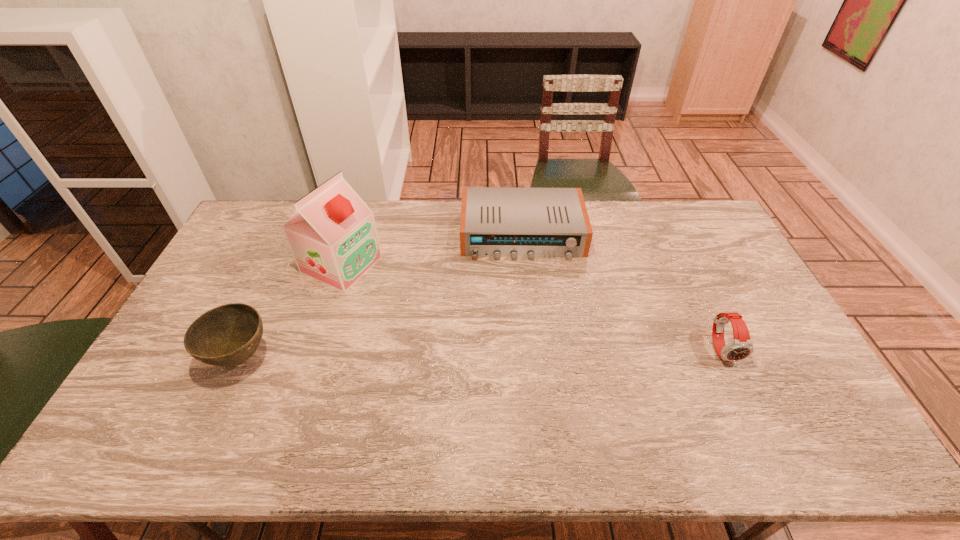
This screenshot has height=540, width=960. In order to click on vacant space on the desktop that is between the bowl and the watch and is positioned with the cap open on the soya milk in this screenshot , I will do `click(545, 352)`.

The height and width of the screenshot is (540, 960). In order to click on vacant spot on the desktop that is between the bowl and the rightmost object and is positioned on the front panel of the third object from left to right in this screenshot , I will do `click(532, 352)`.